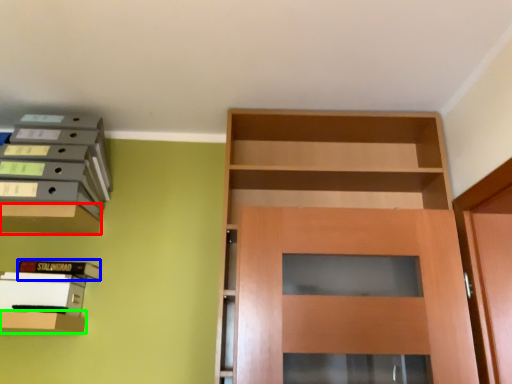
Question: Which object is the closest to the cabinetry (highlighted by a red box)? Choose among these: book (highlighted by a blue box) or shelf (highlighted by a green box).

Choices:
 (A) book
 (B) shelf

Answer: (A)